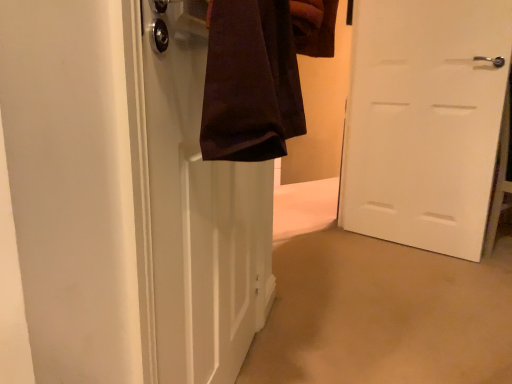
The image size is (512, 384). Identify the location of vacant region in front of white matte door at center. 420,276.